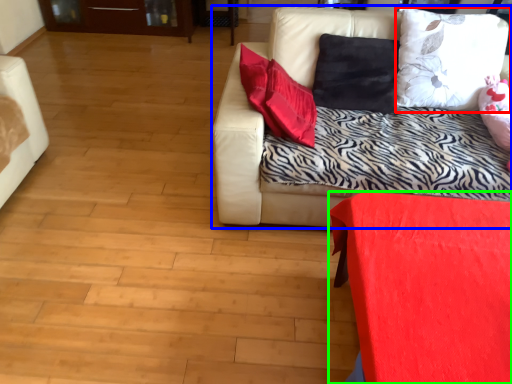
Question: Considering the real-world distances, which object is farthest from pillow (highlighted by a red box)? studio couch (highlighted by a blue box) or furniture (highlighted by a green box)?

Choices:
 (A) studio couch
 (B) furniture

Answer: (B)